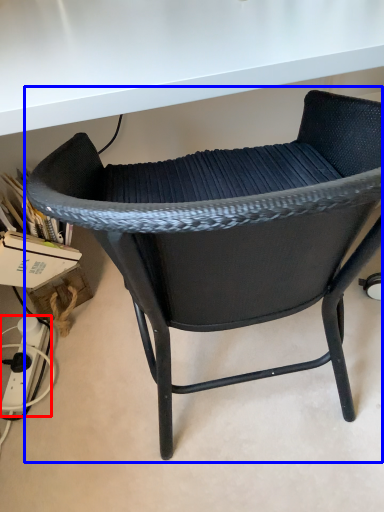
Question: Which of the following is the farthest to the observer, plug (highlighted by a red box) or chair (highlighted by a blue box)?

Choices:
 (A) plug
 (B) chair

Answer: (A)